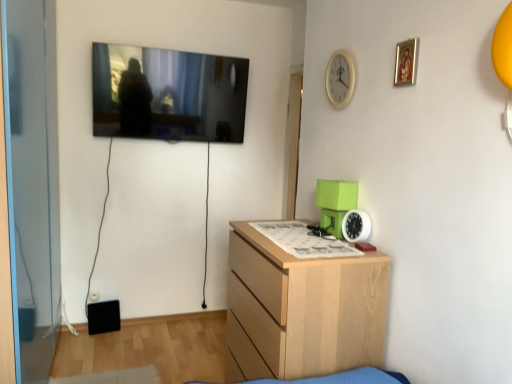
Locate an element on the screen. The image size is (512, 384). vacant space situated on the left part of white plastic clock at right, the 1th clock from the bottom is located at coordinates (316, 243).